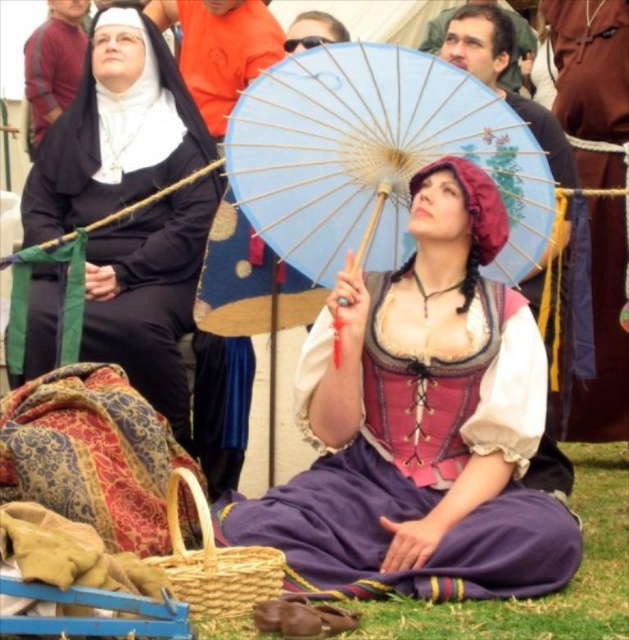
Question: Estimate the real-world distances between objects in this image. Which object is closer to the matte pink fabric dress at center?

Choices:
 (A) purple satin dress at center
 (B) brown leather belt at upper center

Answer: (B)

Question: Does matte pink fabric dress at center appear on the right side of brown leather belt at upper center?

Choices:
 (A) no
 (B) yes

Answer: (A)

Question: Does purple satin dress at center appear over brown leather belt at upper center?

Choices:
 (A) yes
 (B) no

Answer: (B)

Question: Which point appears closest to the camera in this image?

Choices:
 (A) (598, 266)
 (B) (276, 211)
 (C) (309, 397)
 (D) (214, 148)

Answer: (C)

Question: Does matte pink fabric dress at center have a smaller size compared to blue paper umbrella at center?

Choices:
 (A) no
 (B) yes

Answer: (A)

Question: Which point is closer to the camera?

Choices:
 (A) matte pink fabric dress at center
 (B) brown leather belt at upper center

Answer: (A)